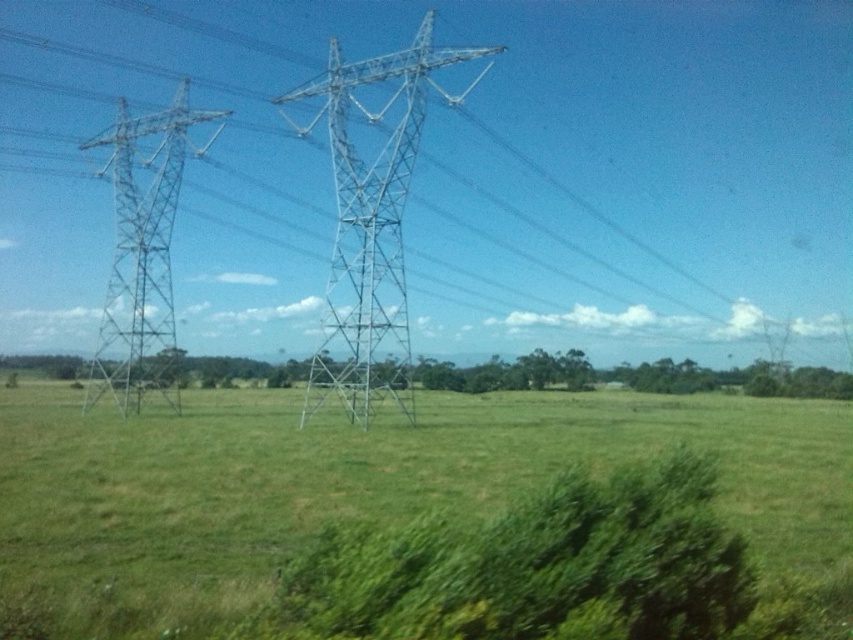
You are a drone operator planning to fly a drone over the rural landscape. The drone has a maximum flight height of 1 meter. Considering the metallic silver power line at left and the green grassy field at center, will the drone be able to pass safely below the power line without hitting it?

The metallic silver power line at left is taller than the green grassy field at center. Since the drone can only fly up to 1 meter, which is likely lower than the height of the power line, it should be able to pass safely below the power line without hitting it.

You are a drone operator planning to fly a drone over the rural landscape. The drone has a wingspan of 1.2 meters. You need to ensure it can safely pass between the green grassy field at center and the metallic silver tower at center. Can the drone fit through the space between them?

The green grassy field at center is wider than the metallic silver tower at center. However, the description does not provide specific measurements for their widths. Without knowing the exact width of the space between them, it is impossible to determine if the drone with a 1.2 meter wingspan can safely pass through.